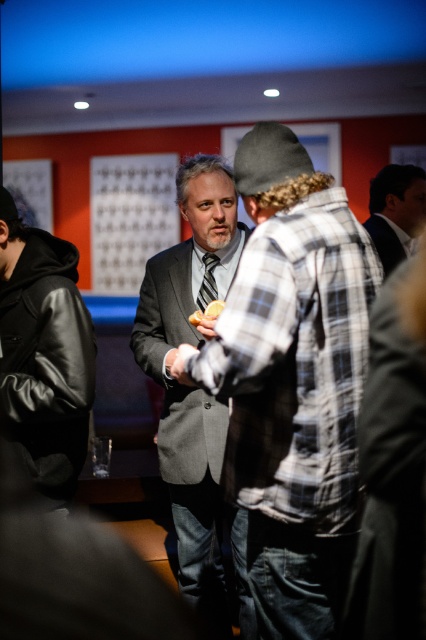
You are planning to place a 1.5 meter long table between the gray suit at center and the dark gray suit at upper right. Will the table fit between them without overlapping?

The distance between the gray suit at center and the dark gray suit at upper right is 1.52 meters. Since the table is 1.5 meters long, it will fit with a small gap of 2 centimeters remaining between them.

You are organizing a charity event and need to arrange seating based on the height of the guests. You have two guests wearing the gray suit at center and the dark gray suit at upper right. Which guest should you seat at the shorter table to ensure comfort?

The gray suit at center is taller than the dark gray suit at upper right, so the guest in the dark gray suit at upper right should be seated at the shorter table for comfort.

You are organizing a closet and need to place the plaid flannel shirt at center and the dark gray suit at center on a shelf. Given that the shelf has limited space, which of the two items should you place first to ensure both fit properly?

The plaid flannel shirt at center is wider than the dark gray suit at center. To ensure both items fit on the shelf, you should place the wider plaid flannel shirt at center first, then the narrower dark gray suit at center.